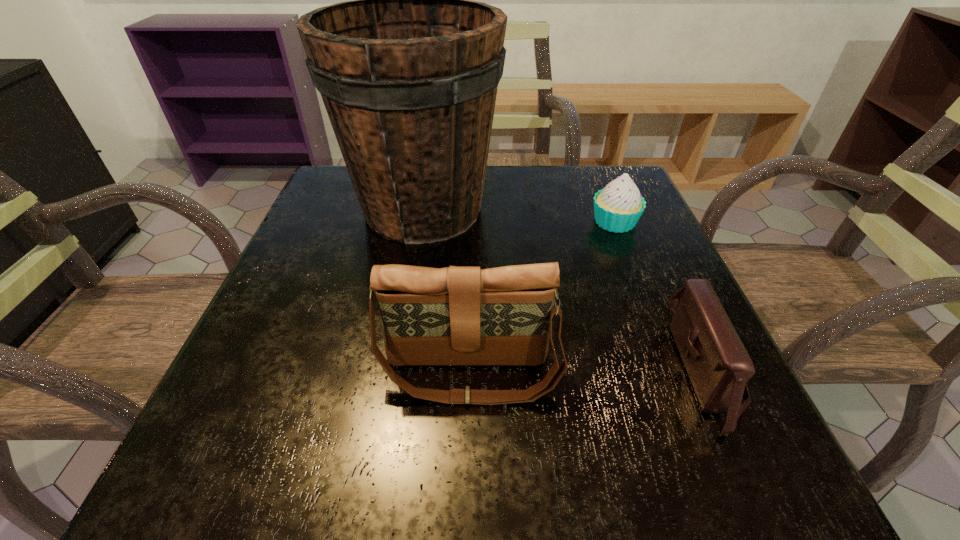
In order to click on empty space between the cupcake and the right shoulder bag in this screenshot , I will do `click(660, 295)`.

You are a GUI agent. You are given a task and a screenshot of the screen. Output one action in this format:
    pyautogui.click(x=<x>, y=<y>)
    Task: Click on the vacant space that is in between the tallest object and the shorter shoulder bag
    
    Given the screenshot: What is the action you would take?
    pyautogui.click(x=564, y=289)

The image size is (960, 540). What are the coordinates of `the closest object to the cupcake` in the screenshot? It's located at 408,72.

I want to click on object that stands as the third closest to the shorter shoulder bag, so click(408, 72).

Where is `vacant area that satisfies the following two spatial constraints: 1. on the front flap of the right shoulder bag; 2. on the front-facing side of the taller shoulder bag`? The width and height of the screenshot is (960, 540). vacant area that satisfies the following two spatial constraints: 1. on the front flap of the right shoulder bag; 2. on the front-facing side of the taller shoulder bag is located at coordinates (708, 373).

Locate an element on the screen. The width and height of the screenshot is (960, 540). free location that satisfies the following two spatial constraints: 1. on the front flap of the shorter shoulder bag; 2. on the front-facing side of the second tallest object is located at coordinates (708, 373).

What are the coordinates of `free spot that satisfies the following two spatial constraints: 1. on the front flap of the right shoulder bag; 2. on the front-facing side of the left shoulder bag` in the screenshot? It's located at (708, 373).

Identify the location of vacant area that satisfies the following two spatial constraints: 1. on the front flap of the right shoulder bag; 2. on the front-facing side of the taller shoulder bag. (708, 373).